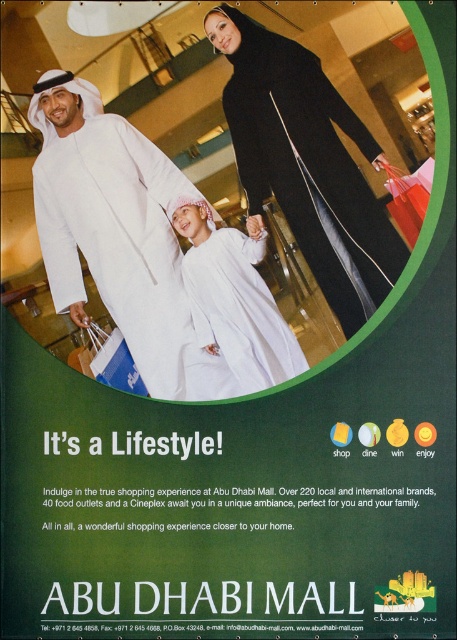
Who is lower down, black matte abaya at center or white matte dress at center?

white matte dress at center is lower down.

Image resolution: width=457 pixels, height=640 pixels. What do you see at coordinates (307, 163) in the screenshot? I see `black matte abaya at center` at bounding box center [307, 163].

Who is more distant from viewer, (x=340, y=291) or (x=246, y=355)?

Result: The point (x=246, y=355) is more distant.

The height and width of the screenshot is (640, 457). Find the location of `black matte abaya at center`. black matte abaya at center is located at coordinates (307, 163).

Looking at this image, who is positioned more to the right, white matte abaya at center or black matte abaya at center?

Positioned to the right is black matte abaya at center.

What do you see at coordinates (116, 234) in the screenshot? This screenshot has width=457, height=640. I see `white matte abaya at center` at bounding box center [116, 234].

Is point (180, 358) less distant than point (388, 285)?

No, it is behind (388, 285).

At what (x,y) coordinates should I click in order to perform the action: click on white matte abaya at center. Please return your answer as a coordinate pair (x, y). This screenshot has height=640, width=457. Looking at the image, I should click on (116, 234).

Between white matte abaya at center and white matte dress at center, which one appears on the right side from the viewer's perspective?

Positioned to the right is white matte dress at center.

You are a GUI agent. You are given a task and a screenshot of the screen. Output one action in this format:
    pyautogui.click(x=<x>, y=<y>)
    Task: Click on the white matte abaya at center
    Image resolution: width=457 pixels, height=640 pixels.
    Given the screenshot: What is the action you would take?
    pyautogui.click(x=116, y=234)